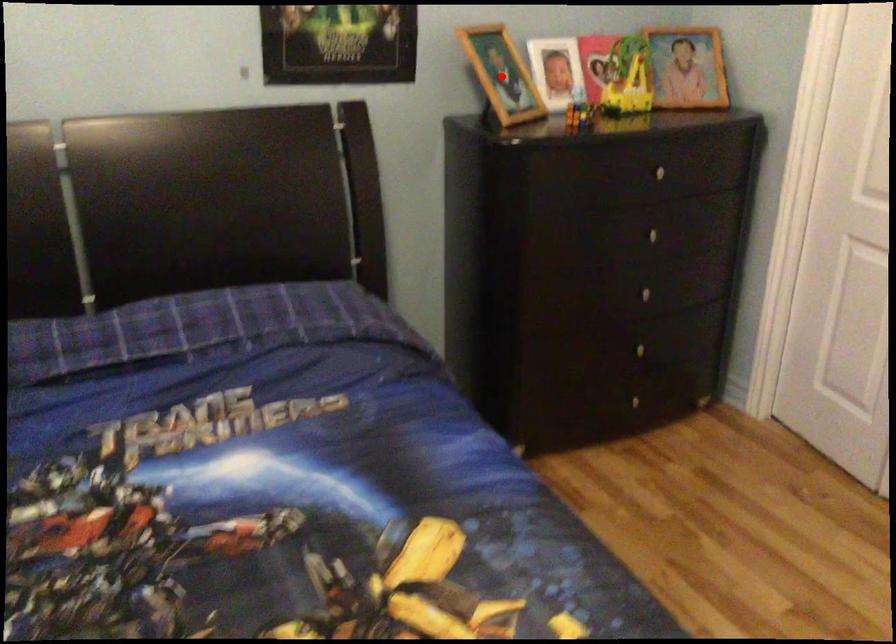
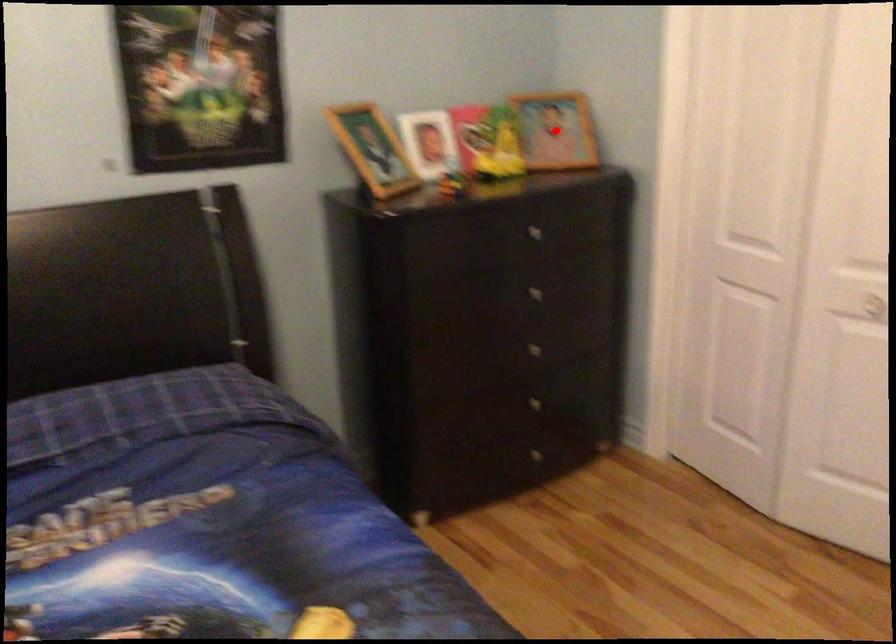
I am providing you with two images of the same scene from different viewpoints. A red point is marked on the first image and another point is marked on the second image. Do the highlighted points in image1 and image2 indicate the same real-world spot?

No